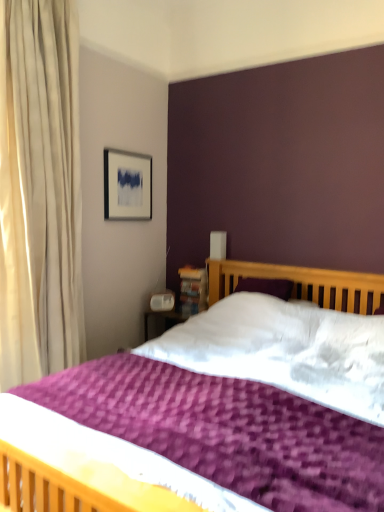
Locate an element on the screen. This screenshot has height=512, width=384. matte silver picture frame at upper left is located at coordinates (127, 185).

You are a GUI agent. You are given a task and a screenshot of the screen. Output one action in this format:
    pyautogui.click(x=<x>, y=<y>)
    Task: Click on the bookshelf on the left of the purple textured bed at center
    This screenshot has width=384, height=512.
    Given the screenshot: What is the action you would take?
    pyautogui.click(x=193, y=290)

Is wooden bookshelf at upper right facing away from purple textured bed at center?

No, wooden bookshelf at upper right is not facing the opposite direction of purple textured bed at center.

Which object is wider, wooden bookshelf at upper right or purple textured bed at center?

With larger width is purple textured bed at center.

Which is farther, (181, 279) or (115, 214)?

The point (181, 279) is farther.

From the image's perspective, which one is positioned lower, wooden bookshelf at upper right or matte silver picture frame at upper left?

wooden bookshelf at upper right appears lower in the image.

From a real-world perspective, which object stands above the other?

From a 3D spatial view, matte silver picture frame at upper left is above.

Can you tell me how much matte silver picture frame at upper left and purple textured bed at center differ in facing direction?

They differ by 90 degrees in their facing directions.

You are a GUI agent. You are given a task and a screenshot of the screen. Output one action in this format:
    pyautogui.click(x=<x>, y=<y>)
    Task: Click on the bed in front of the matte silver picture frame at upper left
    This screenshot has width=384, height=512.
    Given the screenshot: What is the action you would take?
    tap(92, 465)

Considering the sizes of objects matte silver picture frame at upper left and purple textured bed at center in the image provided, who is taller, matte silver picture frame at upper left or purple textured bed at center?

With more height is purple textured bed at center.

Can you confirm if purple textured bed at center is thinner than wooden bookshelf at upper right?

No, purple textured bed at center is not thinner than wooden bookshelf at upper right.

Where is `bed that appears below the wooden bookshelf at upper right (from a real-world perspective)`? bed that appears below the wooden bookshelf at upper right (from a real-world perspective) is located at coordinates (92, 465).

Is purple textured bed at center positioned beyond the bounds of wooden bookshelf at upper right?

Indeed, purple textured bed at center is completely outside wooden bookshelf at upper right.

What's the angular difference between purple textured bed at center and wooden bookshelf at upper right's facing directions?

0.353 degrees separate the facing orientations of purple textured bed at center and wooden bookshelf at upper right.

In the scene shown: Which object is closer to the camera taking this photo, purple textured bed at center or matte silver picture frame at upper left?

purple textured bed at center is in front.

In the scene shown: Can you tell me how much purple textured bed at center and matte silver picture frame at upper left differ in facing direction?

The facing directions of purple textured bed at center and matte silver picture frame at upper left are 90 degrees apart.

Is purple textured bed at center taller than matte silver picture frame at upper left?

Correct, purple textured bed at center is much taller as matte silver picture frame at upper left.

From the image's perspective, is purple textured bed at center positioned above or below matte silver picture frame at upper left?

Clearly, from the image's perspective, purple textured bed at center is below matte silver picture frame at upper left.

Which object is further away from the camera, matte silver picture frame at upper left or wooden bookshelf at upper right?

wooden bookshelf at upper right is more distant.

From a real-world perspective, is matte silver picture frame at upper left beneath wooden bookshelf at upper right?

Answer: Incorrect, from a real-world perspective, matte silver picture frame at upper left is higher than wooden bookshelf at upper right.

Looking at the image, does matte silver picture frame at upper left seem bigger or smaller compared to wooden bookshelf at upper right?

Clearly, matte silver picture frame at upper left is larger in size than wooden bookshelf at upper right.

Is matte silver picture frame at upper left next to wooden bookshelf at upper right and touching it?

There is a gap between matte silver picture frame at upper left and wooden bookshelf at upper right.

The height and width of the screenshot is (512, 384). I want to click on bed in front of the wooden bookshelf at upper right, so click(92, 465).

The width and height of the screenshot is (384, 512). What are the coordinates of `picture frame on the left of wooden bookshelf at upper right` in the screenshot? It's located at (127, 185).

When comparing their distances from purple textured bed at center, does matte silver picture frame at upper left or wooden bookshelf at upper right seem closer?

Based on the image, wooden bookshelf at upper right appears to be nearer to purple textured bed at center.

Consider the image. Estimate the real-world distances between objects in this image. Which object is closer to wooden bookshelf at upper right, purple textured bed at center or matte silver picture frame at upper left?

matte silver picture frame at upper left is closer to wooden bookshelf at upper right.

Estimate the real-world distances between objects in this image. Which object is further from purple textured bed at center, wooden bookshelf at upper right or matte silver picture frame at upper left?

matte silver picture frame at upper left is further to purple textured bed at center.

Estimate the real-world distances between objects in this image. Which object is further from wooden bookshelf at upper right, matte silver picture frame at upper left or purple textured bed at center?

purple textured bed at center.

Which object lies nearer to the anchor point matte silver picture frame at upper left, wooden bookshelf at upper right or purple textured bed at center?

wooden bookshelf at upper right is positioned closer to the anchor matte silver picture frame at upper left.

When comparing their distances from matte silver picture frame at upper left, does purple textured bed at center or wooden bookshelf at upper right seem further?

purple textured bed at center.

Image resolution: width=384 pixels, height=512 pixels. Identify the location of picture frame located between purple textured bed at center and wooden bookshelf at upper right in the depth direction. (127, 185).